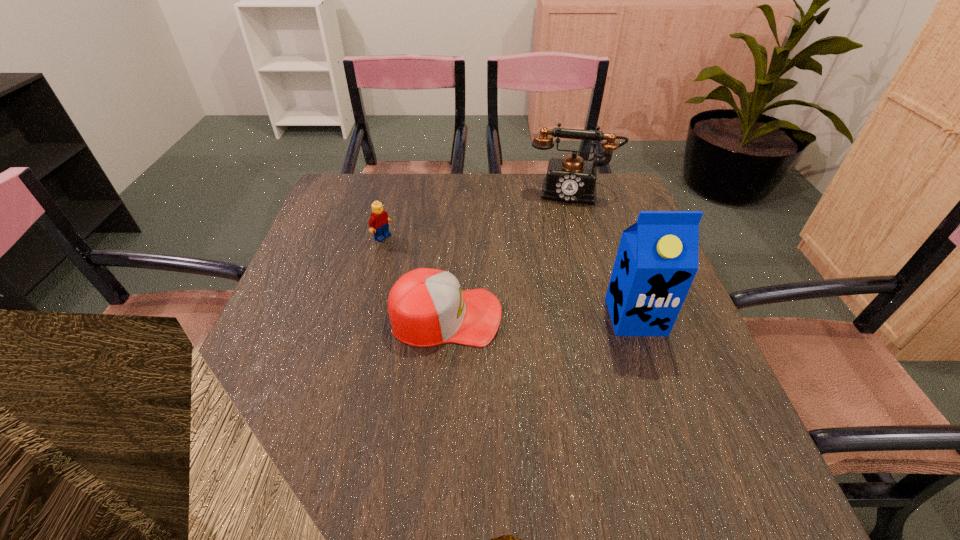
The width and height of the screenshot is (960, 540). In order to click on the second object from left to right in this screenshot , I will do `click(427, 307)`.

Find the location of a particular element. the tallest object is located at coordinates (657, 259).

The width and height of the screenshot is (960, 540). Find the location of `telephone`. telephone is located at coordinates (571, 179).

Identify the location of the third shortest object. (571, 179).

At what (x,y) coordinates should I click in order to perform the action: click on Lego. Please return your answer as a coordinate pair (x, y). Looking at the image, I should click on (378, 223).

Locate an element on the screen. The image size is (960, 540). the second farthest object is located at coordinates (378, 223).

You are a GUI agent. You are given a task and a screenshot of the screen. Output one action in this format:
    pyautogui.click(x=<x>, y=<y>)
    Task: Click on the vacant region located 0.200m on the front-facing side of the baseball cap
    Image resolution: width=960 pixels, height=540 pixels.
    Given the screenshot: What is the action you would take?
    pyautogui.click(x=591, y=316)

Where is `free space located with the cap open on the tallest object`? Image resolution: width=960 pixels, height=540 pixels. free space located with the cap open on the tallest object is located at coordinates (660, 386).

Find the location of a particular element. The image size is (960, 540). vacant space positioned 0.220m on the front of the second tallest object at the rotary dial is located at coordinates (562, 252).

At what (x,y) coordinates should I click in order to perform the action: click on blank space located on the front of the second tallest object at the rotary dial. Please return your answer as a coordinate pair (x, y). Looking at the image, I should click on (557, 298).